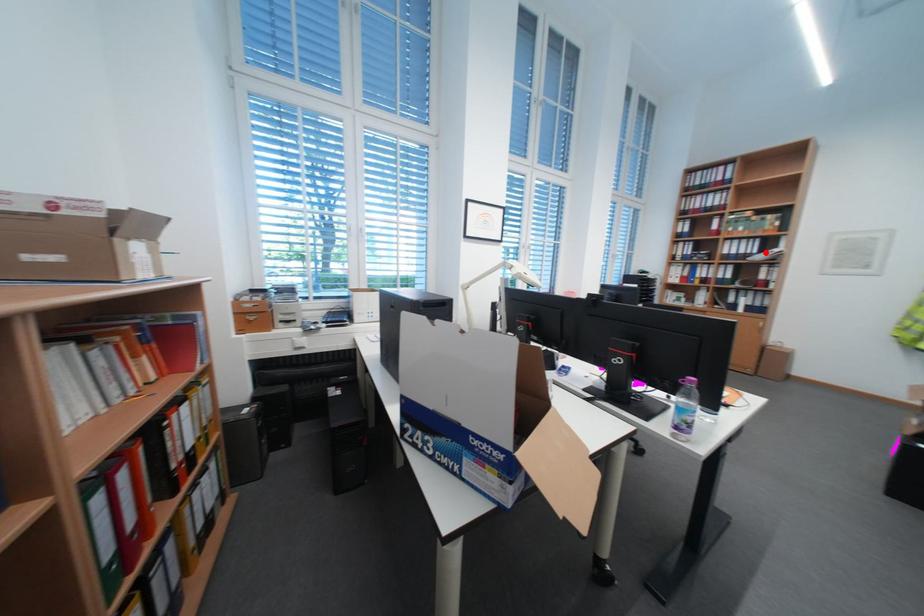
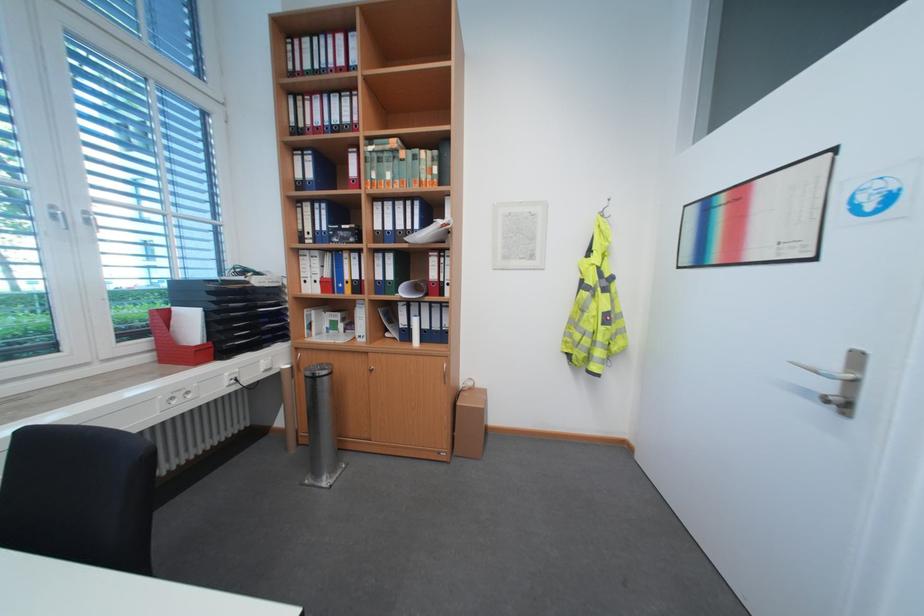
Find the pixel in the second image that matches the highlighted location in the first image.

(428, 227)